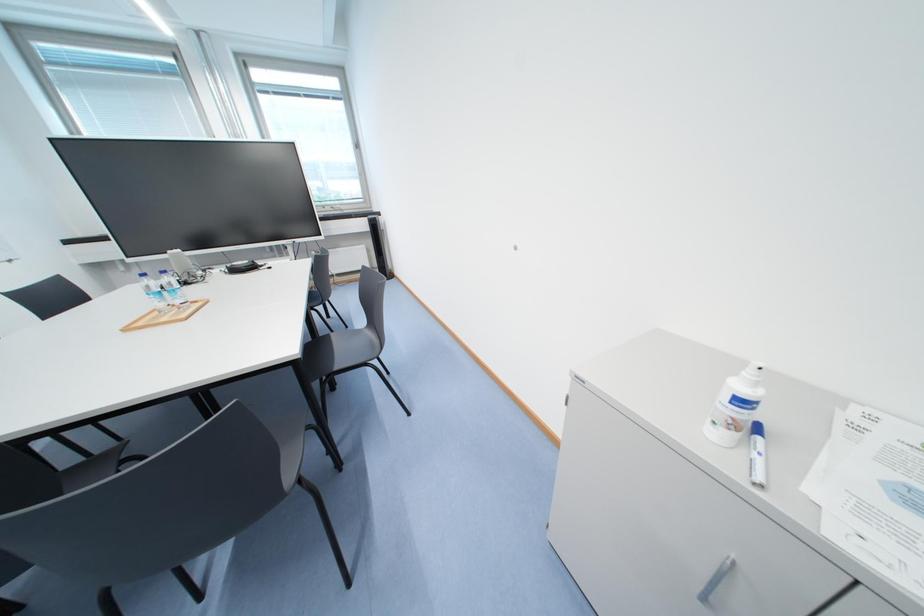
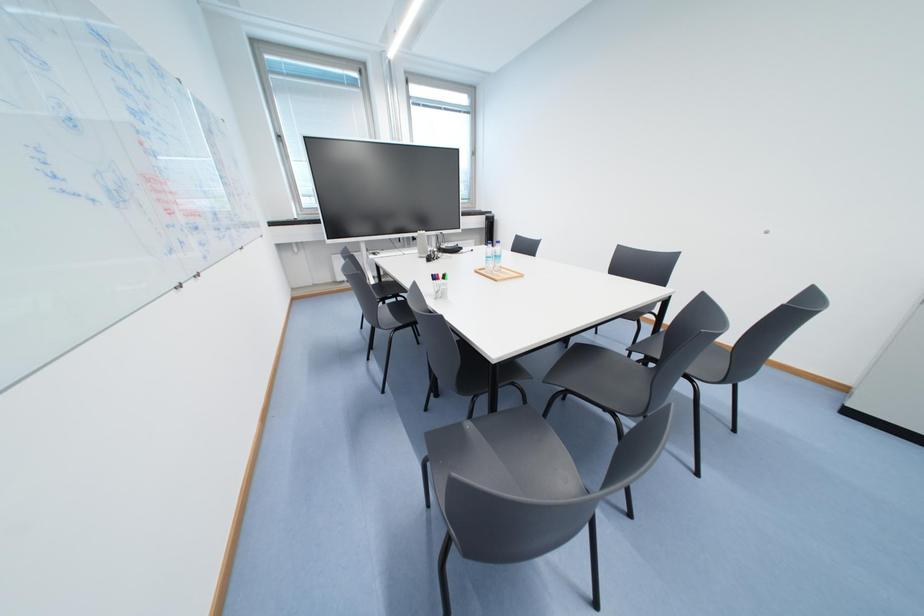
Question: In a continuous first-person perspective shot, in which direction is the camera moving?

Choices:
 (A) Left
 (B) Right
 (C) Forward
 (D) Backward

Answer: (A)